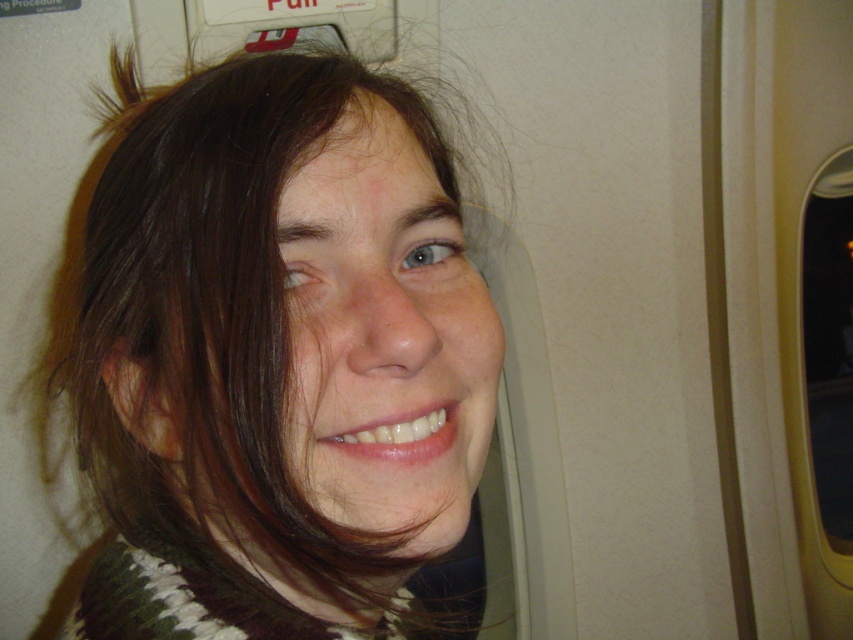
Question: Is the position of dark brown hair at center less distant than that of transparent glass airplane window at right?

Choices:
 (A) yes
 (B) no

Answer: (A)

Question: Can you confirm if dark brown hair at center is positioned to the right of transparent glass airplane window at right?

Choices:
 (A) no
 (B) yes

Answer: (A)

Question: Which of the following is the farthest from the observer?

Choices:
 (A) transparent glass airplane window at right
 (B) dark brown hair at center

Answer: (A)

Question: Is dark brown hair at center thinner than transparent glass airplane window at right?

Choices:
 (A) no
 (B) yes

Answer: (B)

Question: Which point is farther to the camera?

Choices:
 (A) (848, 275)
 (B) (454, 432)

Answer: (A)